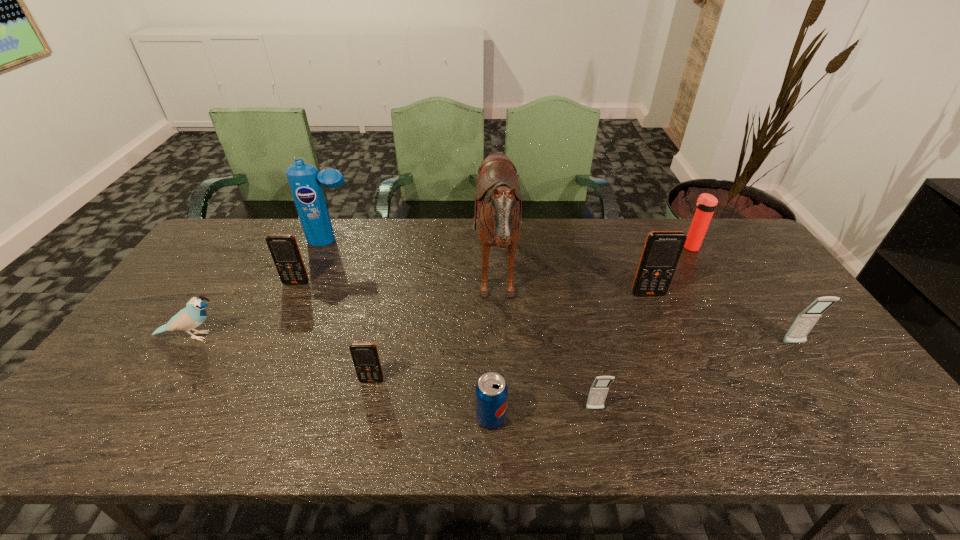
At what (x,y) coordinates should I click in order to perform the action: click on blue bird. Please return your answer as a coordinate pair (x, y). The height and width of the screenshot is (540, 960). Looking at the image, I should click on (194, 314).

At what (x,y) coordinates should I click in order to perform the action: click on bird. Please return your answer as a coordinate pair (x, y). Looking at the image, I should click on (194, 314).

At what (x,y) coordinates should I click in order to perform the action: click on the second orange cellular telephone from left to right. Please return your answer as a coordinate pair (x, y). Looking at the image, I should click on (365, 356).

Locate an element on the screen. This screenshot has height=540, width=960. the eighth farthest object is located at coordinates (365, 356).

Identify the location of the left gray cellular telephone. This screenshot has width=960, height=540. (599, 389).

Locate an element on the screen. the smaller gray cellular telephone is located at coordinates (599, 389).

The width and height of the screenshot is (960, 540). Find the location of `pop soda`. pop soda is located at coordinates click(491, 392).

Image resolution: width=960 pixels, height=540 pixels. I want to click on vacant space located on the back of the saddle, so click(x=402, y=281).

At what (x,y) coordinates should I click in order to perform the action: click on free location located on the back of the saddle. Please return your answer as a coordinate pair (x, y). Looking at the image, I should click on (347, 281).

Find the location of `vacant space located on the back of the saddle`. vacant space located on the back of the saddle is located at coordinates (454, 281).